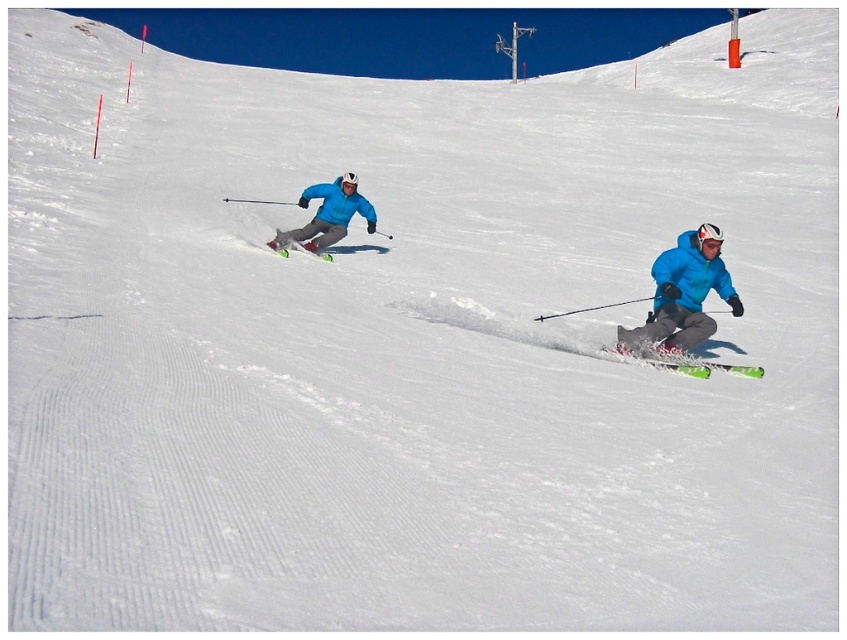
Between green glossy ski at lower right and green matte ski at left, which one has less height?

green glossy ski at lower right is shorter.

Does green glossy ski at lower right have a smaller size compared to green matte ski at left?

No.

This screenshot has height=640, width=847. I want to click on green glossy ski at lower right, so click(724, 368).

Is blue matte jacket at center thinner than green glossy ski at lower right?

Incorrect, blue matte jacket at center's width is not less than green glossy ski at lower right's.

Who is shorter, blue matte jacket at center or green glossy ski at lower right?

With less height is green glossy ski at lower right.

Which is behind, point (355, 188) or point (655, 362)?

The point (355, 188) is more distant.

You are a GUI agent. You are given a task and a screenshot of the screen. Output one action in this format:
    pyautogui.click(x=<x>, y=<y>)
    Task: Click on the blue matte jacket at center
    
    Given the screenshot: What is the action you would take?
    click(x=590, y=308)

Between point (342, 193) and point (320, 253), which one is positioned behind?

The point (342, 193) is more distant.

Does point (353, 211) lie in front of point (324, 259)?

No.

What are the coordinates of `blue matte jacket at center` in the screenshot? It's located at point(590,308).